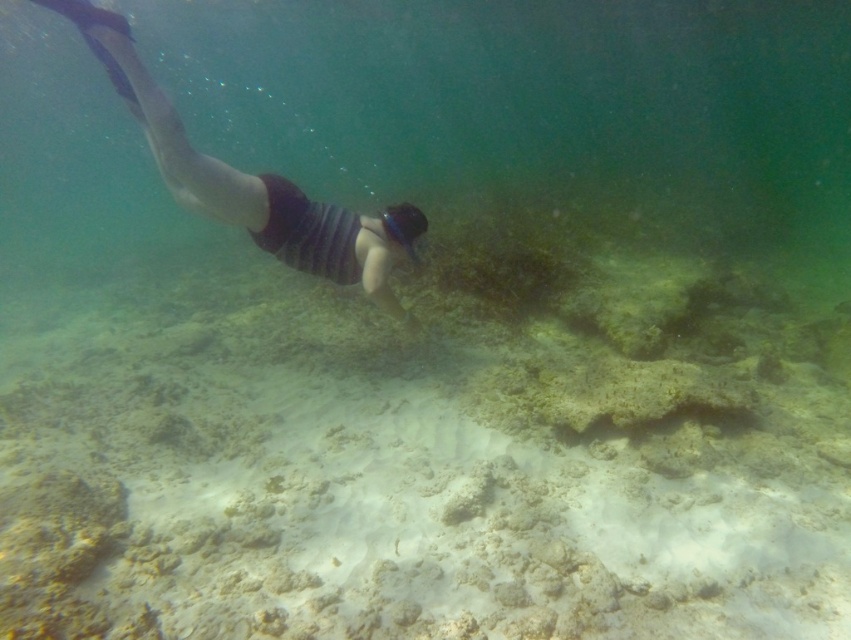
You are a marine biologist observing the underwater scene. You notice the striped fabric snorkeler at upper left and the transparent plastic goggles at center. Which object is located higher in the water column?

The striped fabric snorkeler at upper left is positioned over transparent plastic goggles at center, so the striped fabric snorkeler at upper left is higher in the water column.